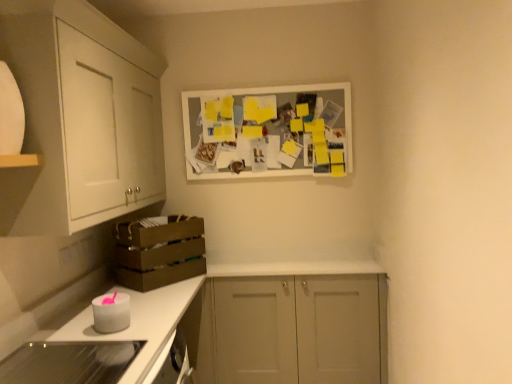
Find the location of a particular element. The image size is (512, 384). free space to the right of white matte candle at lower left, arranged as the 1th appliance when viewed from the top is located at coordinates (159, 325).